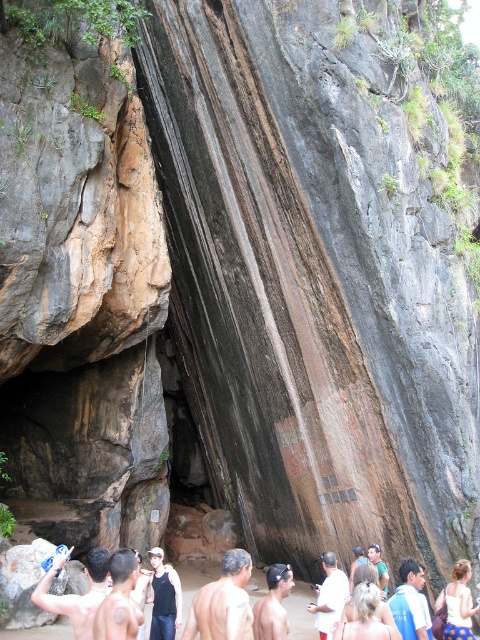
Who is higher up, smooth skin man at center or white matte shirt at center?

white matte shirt at center is above.

Between smooth skin man at center and white matte shirt at center, which one appears on the right side from the viewer's perspective?

white matte shirt at center is more to the right.

You are a GUI agent. You are given a task and a screenshot of the screen. Output one action in this format:
    pyautogui.click(x=<x>, y=<y>)
    Task: Click on the smooth skin man at center
    Image resolution: width=480 pixels, height=640 pixels.
    Given the screenshot: What is the action you would take?
    [273, 604]

Between shiny metallic towel at lower left and smooth brown skin at center, which one is positioned higher?

Positioned higher is smooth brown skin at center.

The width and height of the screenshot is (480, 640). Describe the element at coordinates (76, 595) in the screenshot. I see `shiny metallic towel at lower left` at that location.

Which is in front, point (84, 595) or point (408, 557)?

Point (408, 557)

Find the location of a particular element. shiny metallic towel at lower left is located at coordinates (76, 595).

Is gray hair at lower center further to the viewer compared to green fabric shirt at center?

No, it is in front of green fabric shirt at center.

Is point (224, 586) farther from camera compared to point (374, 554)?

No.

What do you see at coordinates (223, 602) in the screenshot? The image size is (480, 640). I see `gray hair at lower center` at bounding box center [223, 602].

The image size is (480, 640). I want to click on gray hair at lower center, so click(223, 602).